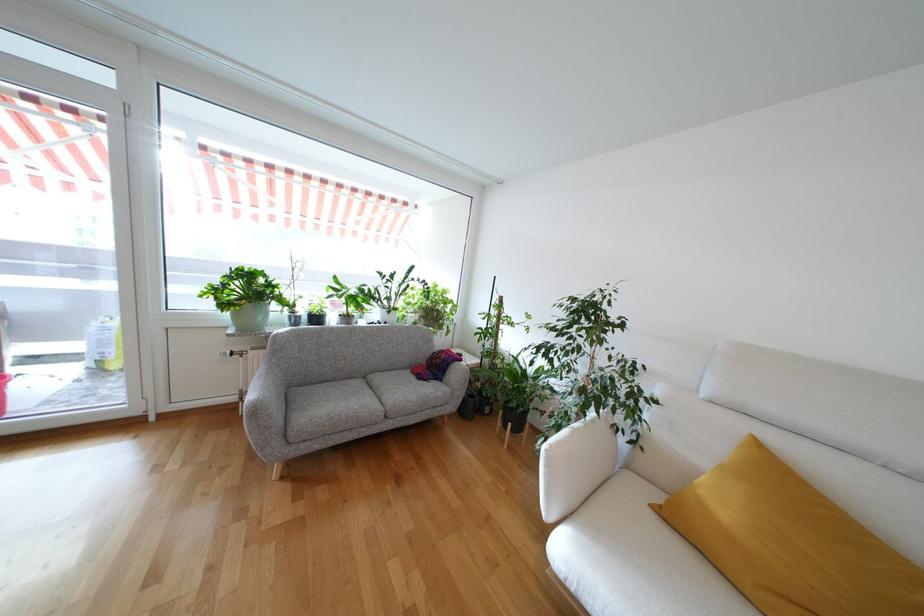
Find the location of a particular element. grey sofa sitting surface is located at coordinates (325, 400).